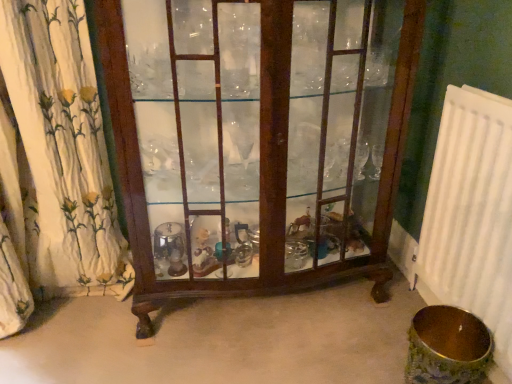
Question: From a real-world perspective, relative to mahogany glass cabinet at center, is white floral fabric at left vertically above or below?

Choices:
 (A) below
 (B) above

Answer: (B)

Question: Relative to mahogany glass cabinet at center, is white floral fabric at left in front or behind?

Choices:
 (A) behind
 (B) front

Answer: (A)

Question: Estimate the real-world distances between objects in this image. Which object is closer to the white plastic radiator at right?

Choices:
 (A) white floral fabric at left
 (B) mahogany glass cabinet at center

Answer: (B)

Question: Estimate the real-world distances between objects in this image. Which object is closer to the mahogany glass cabinet at center?

Choices:
 (A) white plastic radiator at right
 (B) white floral fabric at left

Answer: (B)